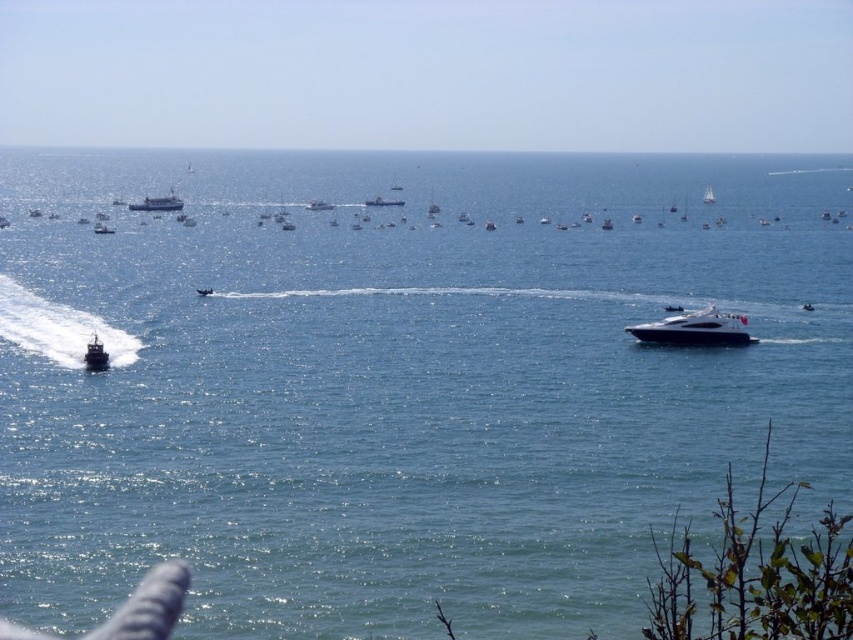
Question: Does metallic silver yacht at center have a smaller size compared to white glossy sailboat at upper center?

Choices:
 (A) no
 (B) yes

Answer: (B)

Question: Does shiny black motorboat at left have a larger size compared to metallic silver boat at left?

Choices:
 (A) no
 (B) yes

Answer: (A)

Question: Which is nearer to the metallic silver yacht at center?

Choices:
 (A) white matte ship at upper center
 (B) metallic silver boat at center

Answer: (B)

Question: Which of the following is the farthest from the observer?

Choices:
 (A) (88, 369)
 (B) (178, 209)
 (C) (97, 230)

Answer: (B)

Question: Estimate the real-world distances between objects in this image. Which object is farther from the shiny black motorboat at left?

Choices:
 (A) metallic silver boat at left
 (B) metallic gray dinghy at center
 (C) glossy white yacht at center-right
 (D) metallic silver yacht at center

Answer: (D)

Question: Is glossy white yacht at center-right smaller than white glossy sailboat at upper center?

Choices:
 (A) no
 (B) yes

Answer: (B)